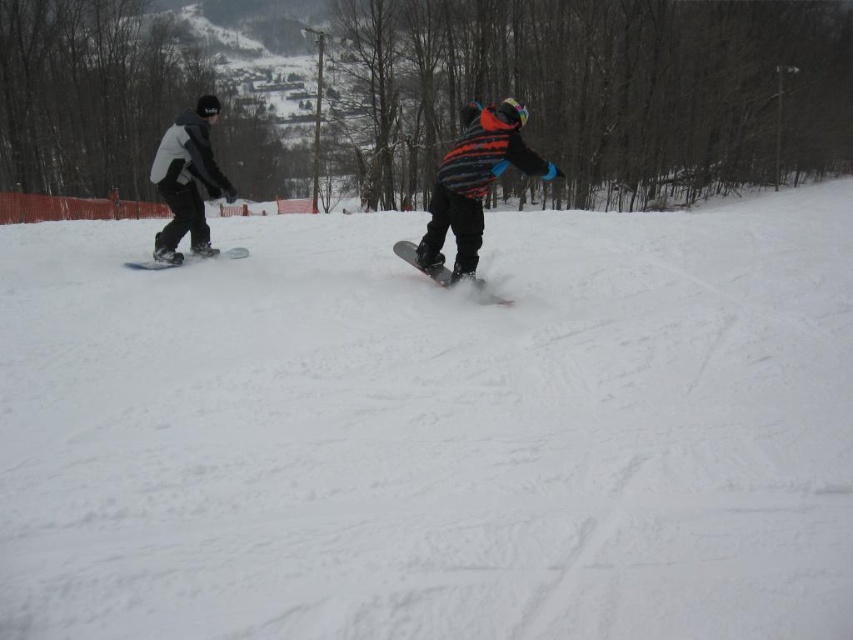
What do you see at coordinates (434, 432) in the screenshot? I see `white matte snow at center` at bounding box center [434, 432].

Which is behind, point (164, 531) or point (468, 186)?

Point (468, 186)

The width and height of the screenshot is (853, 640). In order to click on white matte snow at center in this screenshot , I will do `click(434, 432)`.

Is white matte snow at center to the right of matte black snowboard at center from the viewer's perspective?

Correct, you'll find white matte snow at center to the right of matte black snowboard at center.

Where is `white matte snow at center`? white matte snow at center is located at coordinates (434, 432).

Is striped woolen sweater at center taller than black matte snowboard at left?

Indeed, striped woolen sweater at center has a greater height compared to black matte snowboard at left.

Does point (553, 177) lie behind point (160, 262)?

No, (553, 177) is in front of (160, 262).

The height and width of the screenshot is (640, 853). Find the location of `striped woolen sweater at center`. striped woolen sweater at center is located at coordinates (474, 180).